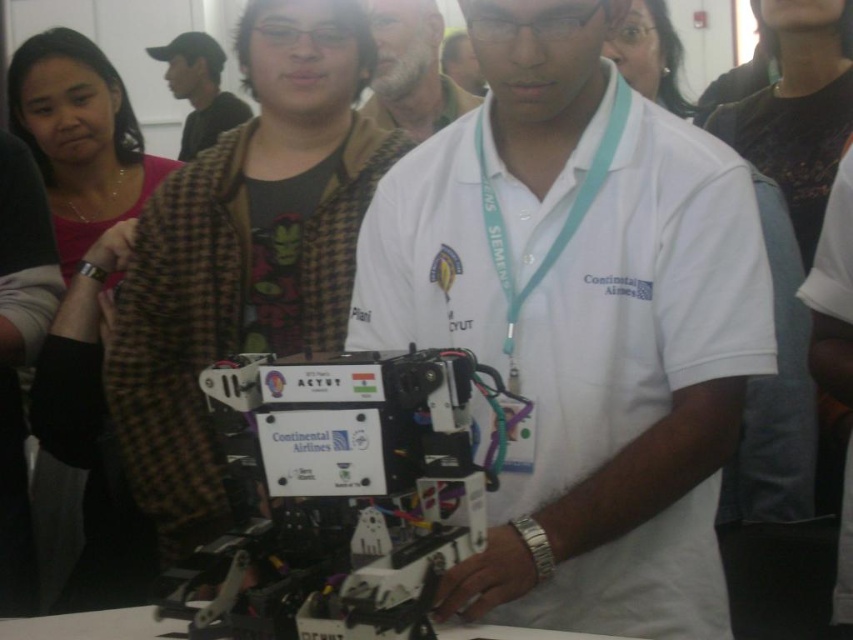
You are a photographer at the event and want to capture a clear photo of the white cotton shirt at center and the white beard at center. Which object should you focus on first to ensure both are in the frame?

The white cotton shirt at center is positioned under the white beard at center, so you should focus on the white beard at center first to ensure both are in the frame.

You are a photographer at the event and need to capture a photo of both the white cotton shirt at center and the brown checkered lab coat at center. Which one is on the left side when facing the scene?

The brown checkered lab coat at center is on the left side because the white cotton shirt at center is positioned on the right side of it.

You are a technician who needs to retrieve a tool from the brown checkered jacket at upper left while standing near the brown checkered lab coat at center. Can you reach the jacket without moving from your current position if your arm can extend 1.5 meters?

The brown checkered lab coat at center is 2.06 meters away from the brown checkered jacket at upper left. Since your arm can only extend 1.5 meters, you cannot reach the jacket without moving.